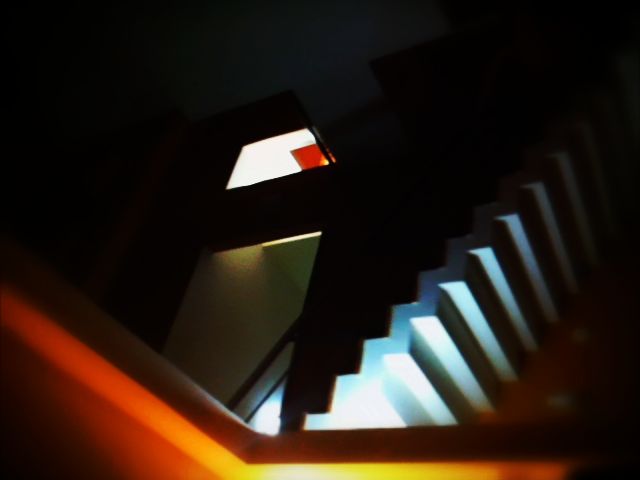
This screenshot has height=480, width=640. In order to click on stairs in this screenshot , I will do `click(402, 317)`.